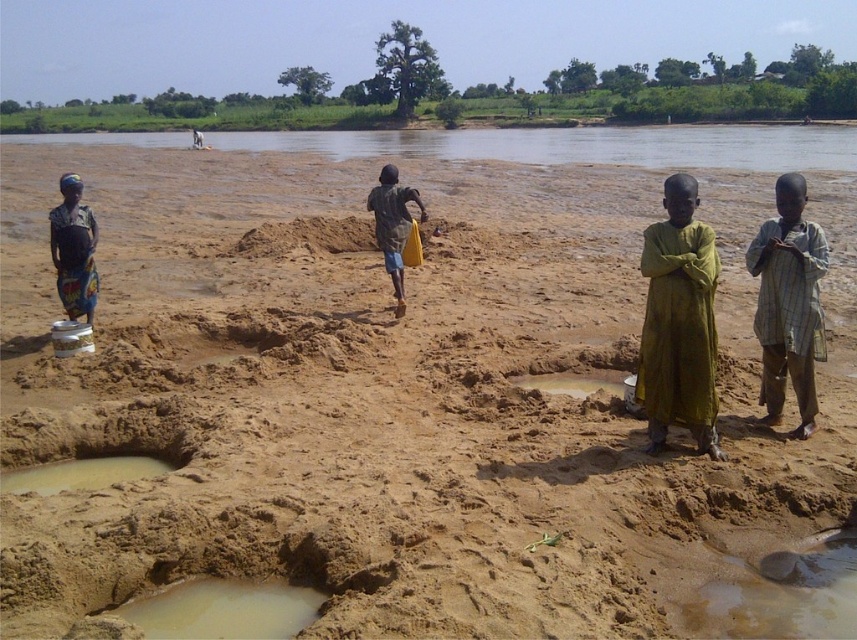
You are standing at the center of the image and want to reach the muddy sand pit at lower left. Which direction should you move?

You should move towards the lower left direction to reach the muddy sand pit at lower left.

You are a hiker who wants to place a small flag exactly halfway between the green cloth at center and the greenish clay hole at lower left. Which object will the flag be closer to?

The flag will be closer to the greenish clay hole at lower left because the green cloth at center is taller than the greenish clay hole at lower left, so the halfway point would be closer to the shorter object.